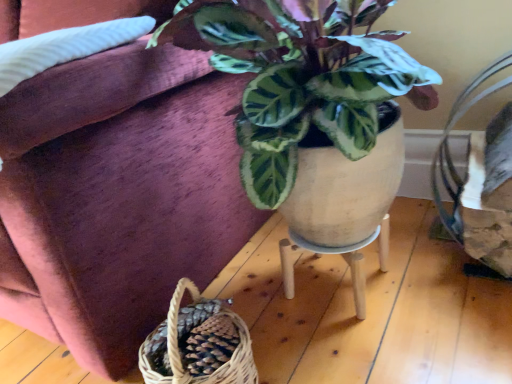
Where is `wooden stool at center`? This screenshot has width=512, height=384. wooden stool at center is located at coordinates (339, 254).

The height and width of the screenshot is (384, 512). Describe the element at coordinates (339, 254) in the screenshot. I see `wooden stool at center` at that location.

Measure the distance between point (63, 189) and camera.

The depth of point (63, 189) is 28.11 inches.

Describe the element at coordinates (117, 196) in the screenshot. I see `velvet couch at upper left` at that location.

You are a GUI agent. You are given a task and a screenshot of the screen. Output one action in this format:
    pyautogui.click(x=<x>, y=<y>)
    Task: Click on the velvet couch at upper left
    This screenshot has height=384, width=512.
    Given the screenshot: What is the action you would take?
    coord(117,196)

Locate an element on the screen. The height and width of the screenshot is (384, 512). wooden stool at center is located at coordinates (339, 254).

Considering the positions of objects wooden stool at center and velvet couch at upper left in the image provided, who is more to the left, wooden stool at center or velvet couch at upper left?

From the viewer's perspective, velvet couch at upper left appears more on the left side.

Consider the image. Is wooden stool at center in front of velvet couch at upper left?

No, it is behind velvet couch at upper left.

Considering the positions of points (294, 240) and (76, 263), is point (294, 240) closer to camera compared to point (76, 263)?

No.

Looking at this image, from the image's perspective, is wooden stool at center over velvet couch at upper left?

No, from the image's perspective, wooden stool at center is not on top of velvet couch at upper left.

From a real-world perspective, which is physically below, wooden stool at center or velvet couch at upper left?

wooden stool at center is physically lower.

Considering the relative sizes of wooden stool at center and velvet couch at upper left in the image provided, is wooden stool at center wider than velvet couch at upper left?

No, wooden stool at center is not wider than velvet couch at upper left.

Considering the sizes of objects wooden stool at center and velvet couch at upper left in the image provided, who is taller, wooden stool at center or velvet couch at upper left?

With more height is velvet couch at upper left.

Who is smaller, wooden stool at center or velvet couch at upper left?

wooden stool at center.

Is velvet couch at upper left completely or partially inside wooden stool at center?

No, velvet couch at upper left is located outside of wooden stool at center.

Is wooden stool at center not close to velvet couch at upper left?

No, wooden stool at center is not far away from velvet couch at upper left.

Is wooden stool at center facing towards velvet couch at upper left?

No, wooden stool at center is not facing towards velvet couch at upper left.

Can you tell me how much wooden stool at center and velvet couch at upper left differ in facing direction?

wooden stool at center and velvet couch at upper left are facing 0.241 degrees away from each other.

The image size is (512, 384). I want to click on table lying behind the velvet couch at upper left, so click(339, 254).

Consider the image. Considering the relative positions of velvet couch at upper left and wooden stool at center in the image provided, is velvet couch at upper left to the left of wooden stool at center from the viewer's perspective?

Yes, velvet couch at upper left is to the left of wooden stool at center.

Which object is further away from the camera taking this photo, velvet couch at upper left or wooden stool at center?

wooden stool at center is more distant.

Which is behind, point (116, 262) or point (350, 267)?

The point (350, 267) is more distant.

From the image's perspective, is velvet couch at upper left located beneath wooden stool at center?

Incorrect, from the image's perspective, velvet couch at upper left is higher than wooden stool at center.

From the picture: From a real-world perspective, which is physically below, velvet couch at upper left or wooden stool at center?

wooden stool at center, from a real-world perspective.

Between velvet couch at upper left and wooden stool at center, which one has larger width?

velvet couch at upper left is wider.

Which of these two, velvet couch at upper left or wooden stool at center, stands shorter?

Standing shorter between the two is wooden stool at center.

Does velvet couch at upper left have a larger size compared to wooden stool at center?

Yes, velvet couch at upper left is bigger than wooden stool at center.

In the scene shown: Is velvet couch at upper left completely or partially outside of wooden stool at center?

Absolutely, velvet couch at upper left is external to wooden stool at center.

Based on the photo, would you consider velvet couch at upper left to be distant from wooden stool at center?

No.

Could you tell me if velvet couch at upper left is turned towards wooden stool at center?

No, velvet couch at upper left does not turn towards wooden stool at center.

The width and height of the screenshot is (512, 384). I want to click on couch above the wooden stool at center (from a real-world perspective), so click(117, 196).

This screenshot has height=384, width=512. Find the location of `couch above the wooden stool at center (from the image's perspective)`. couch above the wooden stool at center (from the image's perspective) is located at coordinates (117, 196).

The width and height of the screenshot is (512, 384). Identify the location of table below the velvet couch at upper left (from the image's perspective). (339, 254).